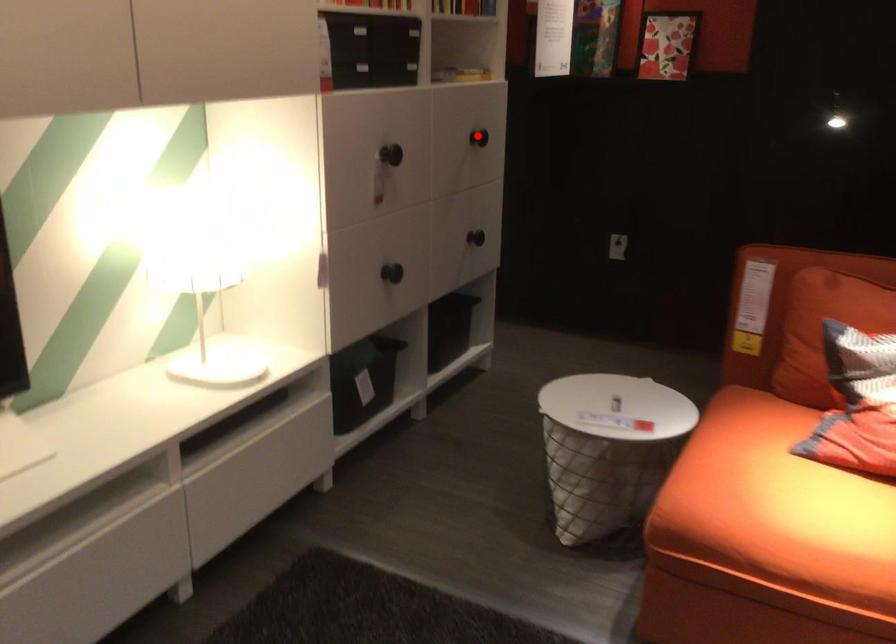
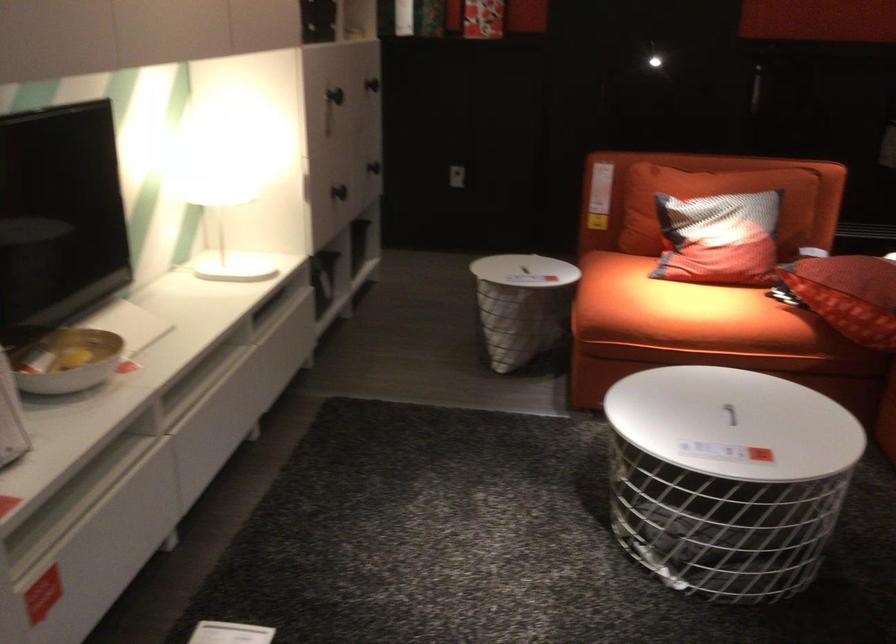
Question: A red point is marked in image1. In image2, is the corresponding 3D point closer to the camera or farther? Reply with the corresponding letter.

Choices:
 (A) The corresponding 3D point is closer.
 (B) The corresponding 3D point is farther.

Answer: (B)